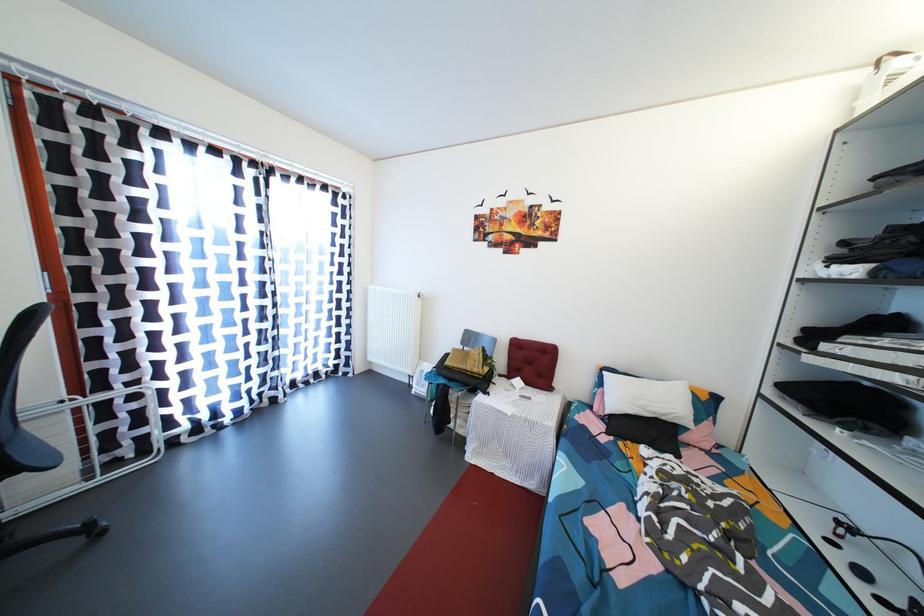
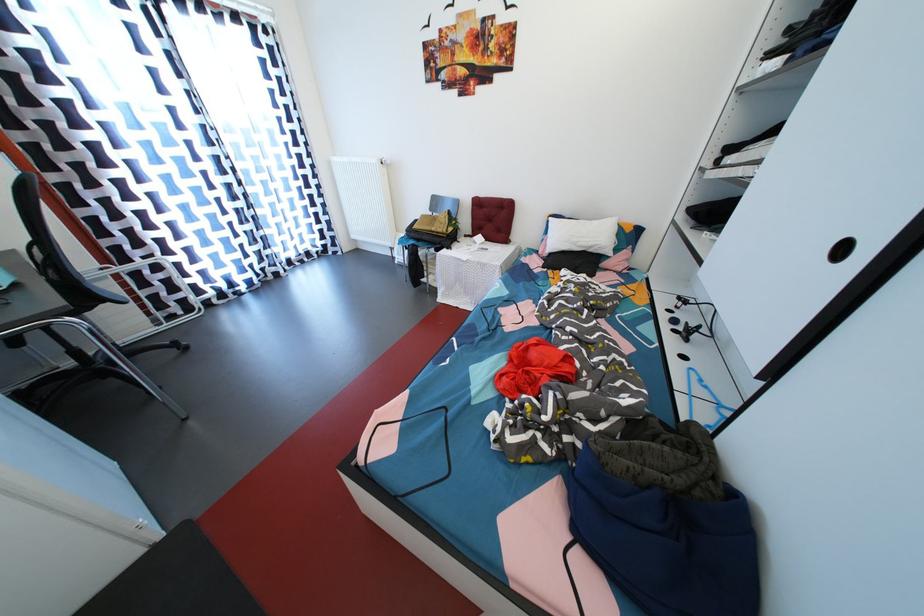
Locate, in the second image, the point that corresponds to point (528, 342) in the first image.

(489, 200)